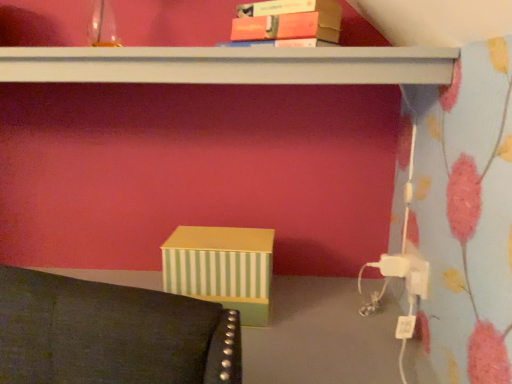
Question: Is matte orange book at upper center surrounding white matte shelf at upper center?

Choices:
 (A) no
 (B) yes

Answer: (A)

Question: From a real-world perspective, is matte orange book at upper center over white matte shelf at upper center?

Choices:
 (A) no
 (B) yes

Answer: (B)

Question: Is there a large distance between matte orange book at upper center and white matte shelf at upper center?

Choices:
 (A) yes
 (B) no

Answer: (B)

Question: Can you confirm if matte orange book at upper center is taller than white matte shelf at upper center?

Choices:
 (A) yes
 (B) no

Answer: (A)

Question: Is matte orange book at upper center positioned in front of white matte shelf at upper center?

Choices:
 (A) yes
 (B) no

Answer: (B)

Question: Does matte orange book at upper center appear on the left side of white matte shelf at upper center?

Choices:
 (A) yes
 (B) no

Answer: (B)

Question: From a real-world perspective, is white matte shelf at upper center located beneath white plastic plug at lower right?

Choices:
 (A) no
 (B) yes

Answer: (A)

Question: Considering the relative sizes of white matte shelf at upper center and white plastic plug at lower right in the image provided, is white matte shelf at upper center bigger than white plastic plug at lower right?

Choices:
 (A) yes
 (B) no

Answer: (A)

Question: Could white plastic plug at lower right be considered to be inside white matte shelf at upper center?

Choices:
 (A) no
 (B) yes

Answer: (A)

Question: Considering the relative sizes of white matte shelf at upper center and white plastic plug at lower right in the image provided, is white matte shelf at upper center wider than white plastic plug at lower right?

Choices:
 (A) no
 (B) yes

Answer: (B)

Question: Is white matte shelf at upper center shorter than white plastic plug at lower right?

Choices:
 (A) no
 (B) yes

Answer: (A)

Question: Could you tell me if white matte shelf at upper center is turned towards white plastic plug at lower right?

Choices:
 (A) no
 (B) yes

Answer: (A)

Question: Does white plastic plug at lower right appear on the right side of white matte shelf at upper center?

Choices:
 (A) no
 (B) yes

Answer: (B)